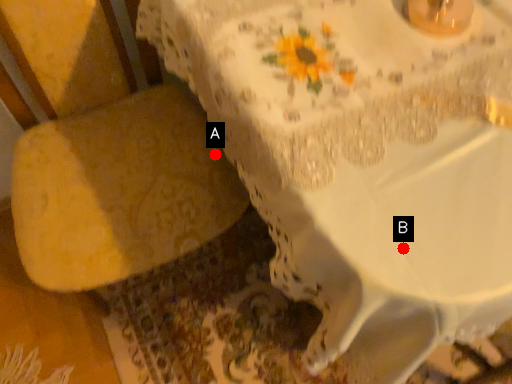
Question: Two points are circled on the image, labeled by A and B beside each circle. Which of the following is the closest to the observer?

Choices:
 (A) A is closer
 (B) B is closer

Answer: (B)